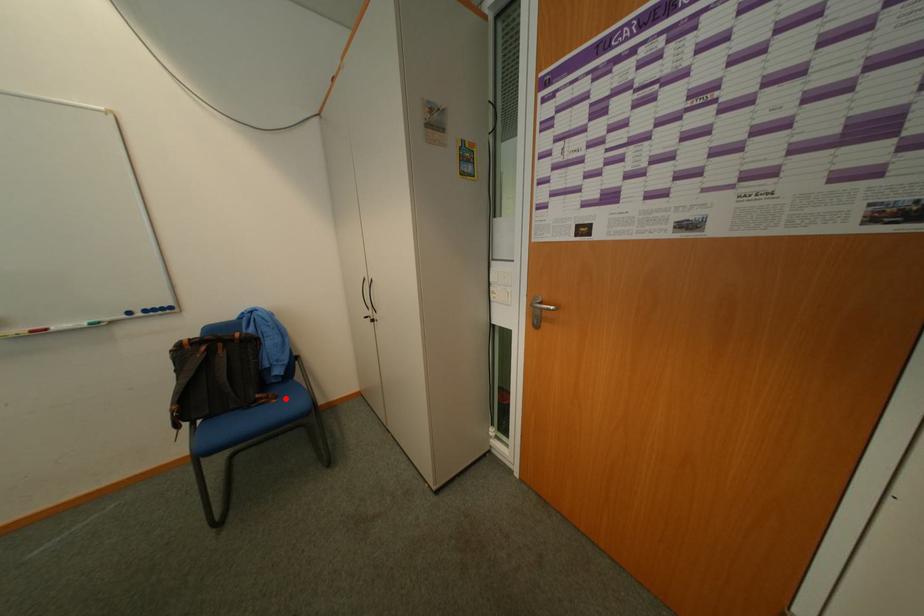
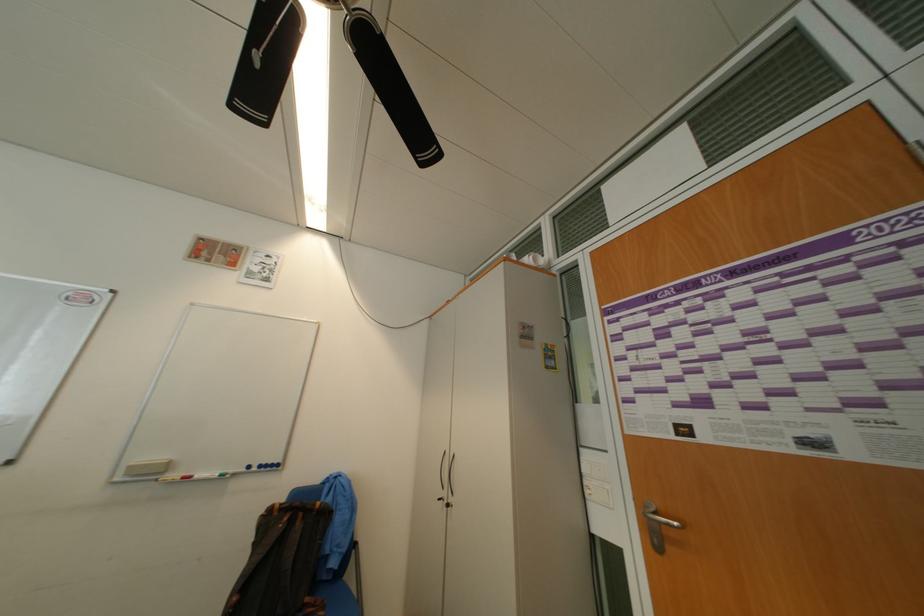
Locate, in the second image, the point that corresponds to the highlighted location in the first image.

(334, 609)